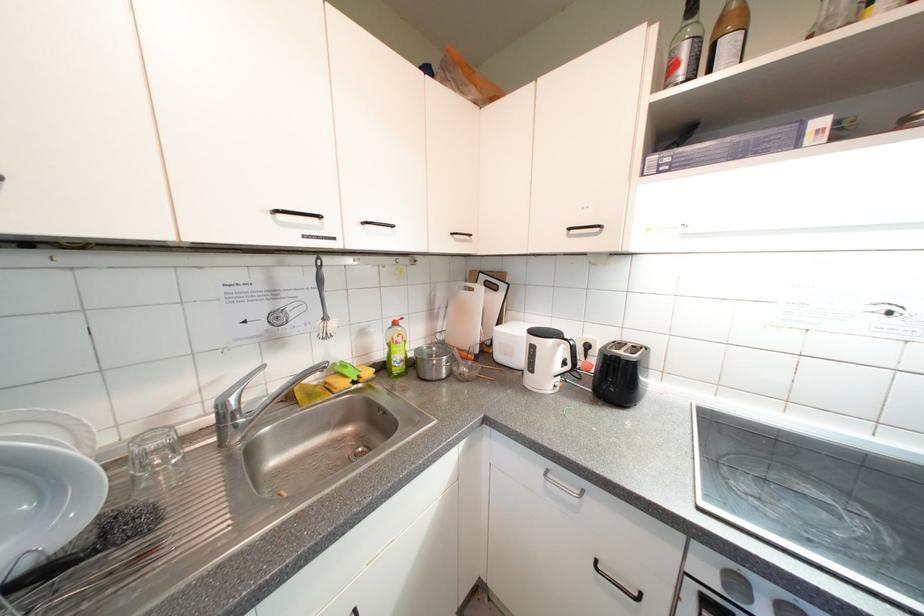
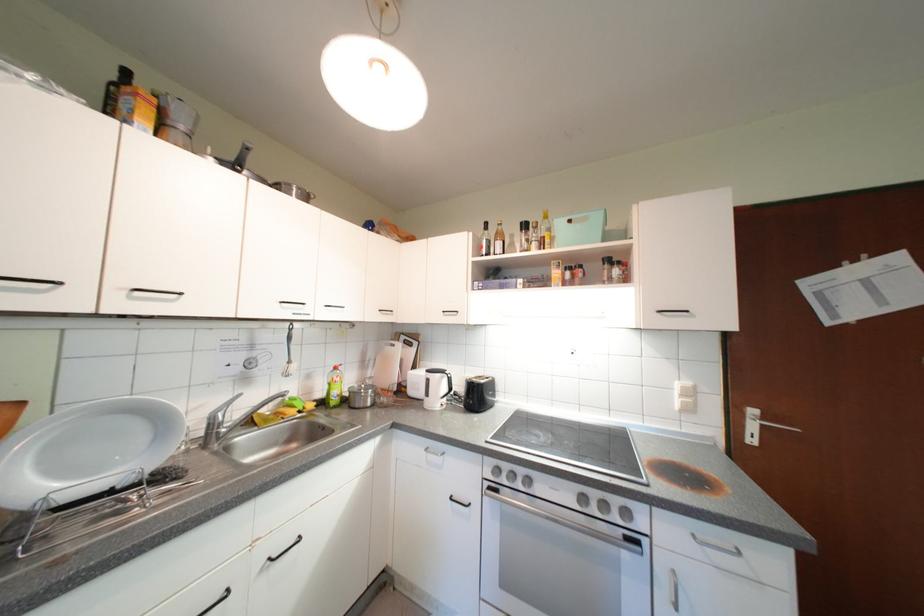
In the second image, find the point that corresponds to [373,225] in the first image.

(335, 309)